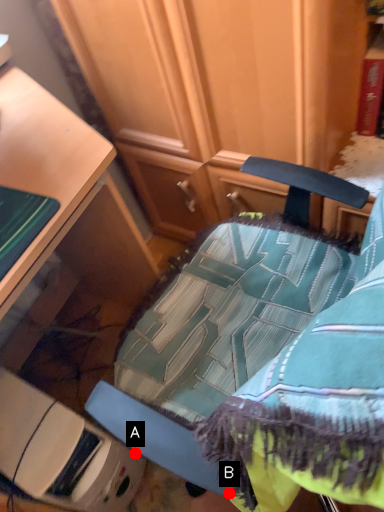
Question: Two points are circled on the image, labeled by A and B beside each circle. Which point is farther from the camera taking this photo?

Choices:
 (A) A is further
 (B) B is further

Answer: (A)